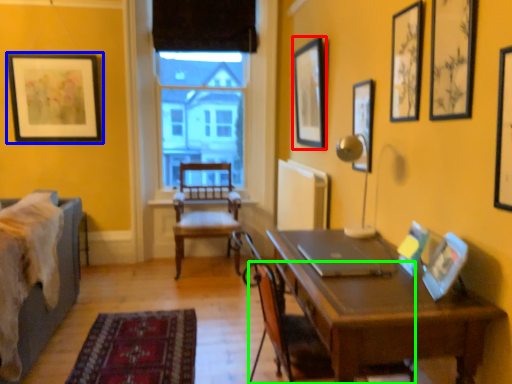
Question: Considering the real-world distances, which object is closest to picture frame (highlighted by a red box)? picture frame (highlighted by a blue box) or chair (highlighted by a green box).

Choices:
 (A) picture frame
 (B) chair

Answer: (B)